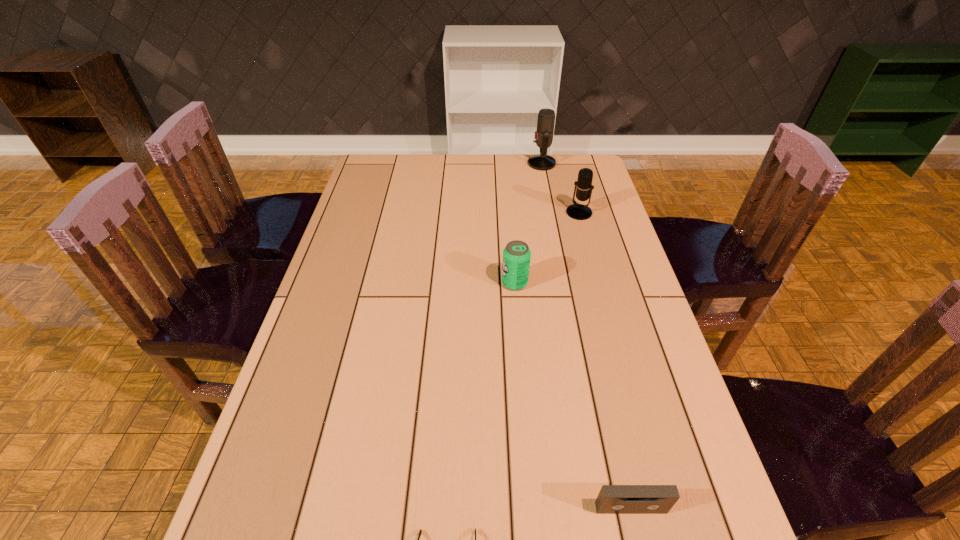
Identify the location of free spot that satisfies the following two spatial constraints: 1. on the side of the taller microphone with the red ring; 2. on the left side of the fourth nearest object. (551, 213).

Find the location of a particular element. This screenshot has width=960, height=540. vacant space that satisfies the following two spatial constraints: 1. on the back side of the shorter microphone; 2. on the side of the farthest object with the red ring is located at coordinates (565, 164).